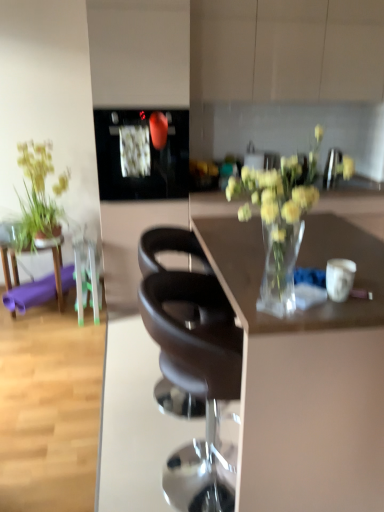
Where is `vacant region in front of purple rubber mat at left`? The image size is (384, 512). vacant region in front of purple rubber mat at left is located at coordinates (36, 335).